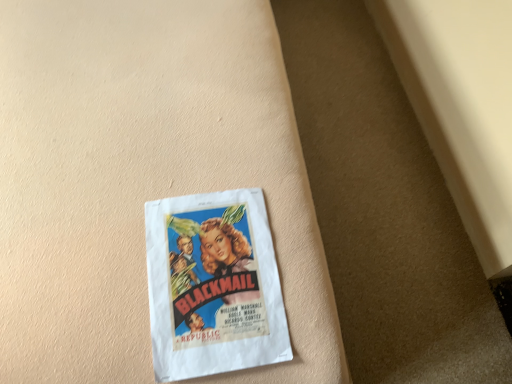
Image resolution: width=512 pixels, height=384 pixels. What are the coordinates of `white paper poster at center` in the screenshot? It's located at (213, 286).

The image size is (512, 384). Describe the element at coordinates (213, 286) in the screenshot. I see `white paper poster at center` at that location.

You are a GUI agent. You are given a task and a screenshot of the screen. Output one action in this format:
    pyautogui.click(x=<x>, y=<y>)
    Task: Click on the white paper poster at center
    This screenshot has width=512, height=384.
    Given the screenshot: What is the action you would take?
    pyautogui.click(x=213, y=286)